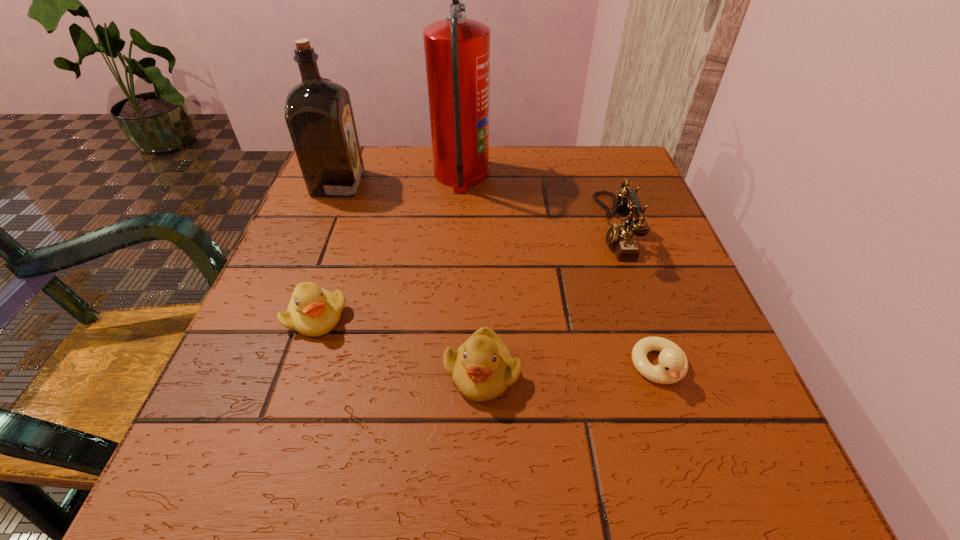
The width and height of the screenshot is (960, 540). In order to click on free region located on the front-facing side of the telephone in this screenshot , I will do `click(408, 228)`.

The image size is (960, 540). Identify the location of free region located on the front-facing side of the telephone. (534, 228).

Identify the location of free space located 0.200m on the front-facing side of the telephone. The width and height of the screenshot is (960, 540). (498, 228).

Identify the location of vacant space located on the front-facing side of the second duckling from right to left. The height and width of the screenshot is (540, 960). (482, 465).

This screenshot has height=540, width=960. Find the location of `vacant space located 0.110m on the beak of the leftmost duckling`. vacant space located 0.110m on the beak of the leftmost duckling is located at coordinates (287, 404).

The width and height of the screenshot is (960, 540). What are the coordinates of `fire extinguisher at the far edge` in the screenshot? It's located at (457, 50).

Locate an element on the screen. The height and width of the screenshot is (540, 960). liquor at the far edge is located at coordinates (318, 112).

You are a GUI agent. You are given a task and a screenshot of the screen. Output one action in this format:
    pyautogui.click(x=<x>, y=<y>)
    Task: Click on the telephone that is positioned at the far edge
    The width and height of the screenshot is (960, 540).
    Given the screenshot: What is the action you would take?
    pos(621,236)

Where is `liquor at the left edge`? liquor at the left edge is located at coordinates (318, 112).

Find the location of `duckling that is at the left edge`. duckling that is at the left edge is located at coordinates (313, 311).